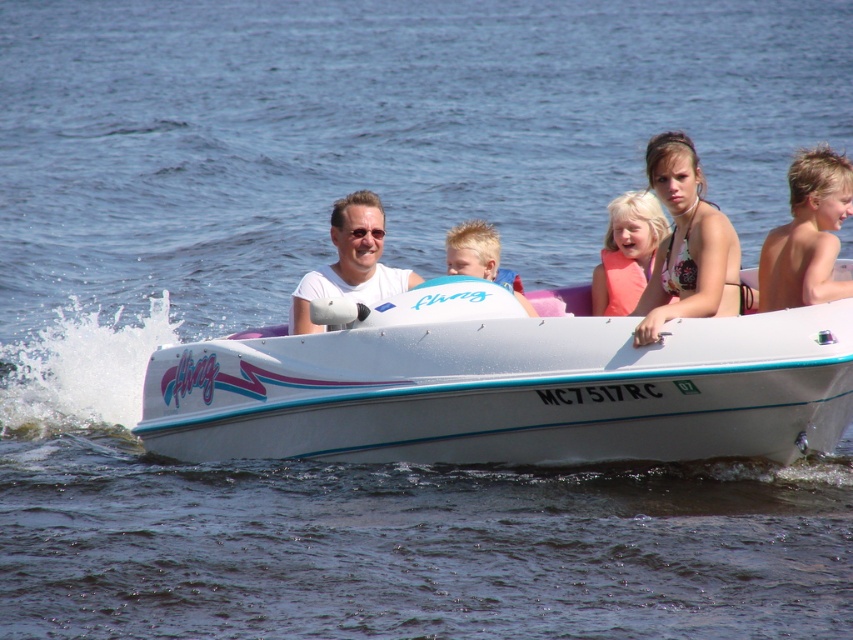
Between point (798, 166) and point (631, 200), which one is positioned behind?

The point (631, 200) is more distant.

Find the location of a particular element. This screenshot has height=640, width=853. blonde hair at upper right is located at coordinates (807, 234).

What do you see at coordinates (807, 234) in the screenshot?
I see `blonde hair at upper right` at bounding box center [807, 234].

Where is `blonde hair at upper right`? blonde hair at upper right is located at coordinates (807, 234).

Does point (666, 337) lie behind point (453, 232)?

No.

Between point (511, 452) and point (482, 244), which one is positioned behind?

Point (482, 244)

You are a GUI agent. You are given a task and a screenshot of the screen. Output one action in this format:
    pyautogui.click(x=<x>, y=<y>)
    Task: Click on the white plastic boat at center
    
    Given the screenshot: What is the action you would take?
    pyautogui.click(x=508, y=388)

Is matte pink bikini top at upper center wider than matte white shirt at center?

No, matte pink bikini top at upper center is not wider than matte white shirt at center.

Is point (744, 310) farther from viewer compared to point (351, 227)?

That is False.

Which is in front, point (720, 298) or point (366, 225)?

Point (720, 298) is in front.

Locate an element on the screen. matte pink bikini top at upper center is located at coordinates (688, 244).